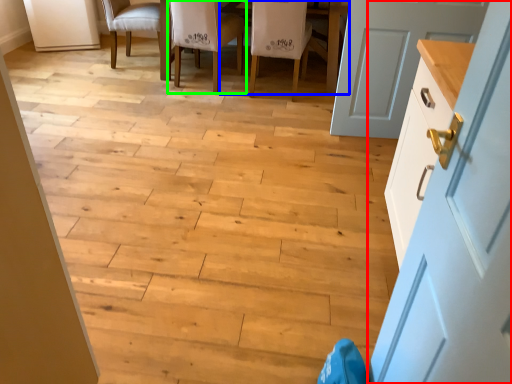
Question: Considering the real-world distances, which object is farthest from door (highlighted by a red box)? table (highlighted by a blue box) or chair (highlighted by a green box)?

Choices:
 (A) table
 (B) chair

Answer: (B)